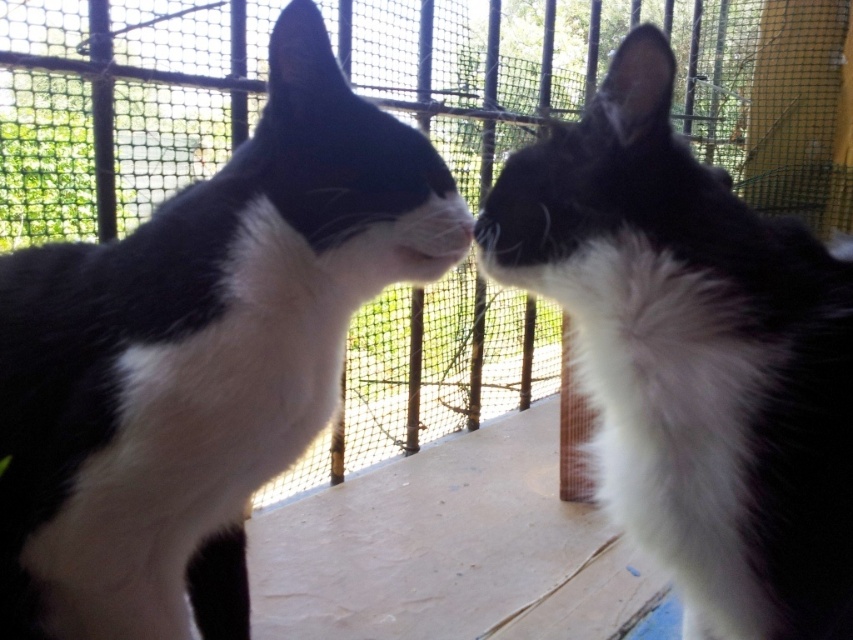
In the scene shown: Does black and white fur cat at left have a lesser width compared to black and white fur at center?

No.

Is black and white fur cat at left positioned before black and white fur at center?

That is False.

Locate an element on the screen. This screenshot has width=853, height=640. black and white fur cat at left is located at coordinates tap(200, 356).